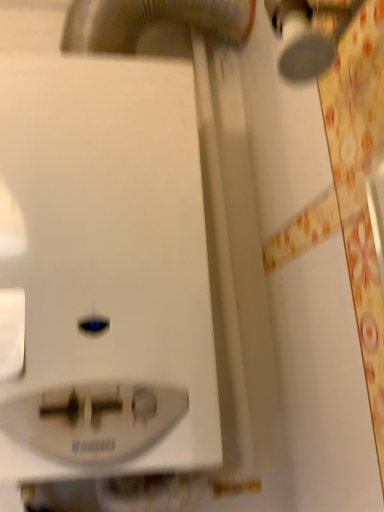
This screenshot has width=384, height=512. What do you see at coordinates (105, 270) in the screenshot?
I see `white plastic light switch at upper center` at bounding box center [105, 270].

Where is `white plastic light switch at upper center`? This screenshot has width=384, height=512. white plastic light switch at upper center is located at coordinates (105, 270).

Measure the distance between white plastic light switch at upper center and camera.

white plastic light switch at upper center and camera are 19.90 inches apart.

You are a GUI agent. You are given a task and a screenshot of the screen. Output one action in this format:
    pyautogui.click(x=<x>, y=<y>)
    Task: Click on the white plastic light switch at upper center
    This screenshot has height=512, width=384.
    Given the screenshot: What is the action you would take?
    point(105,270)